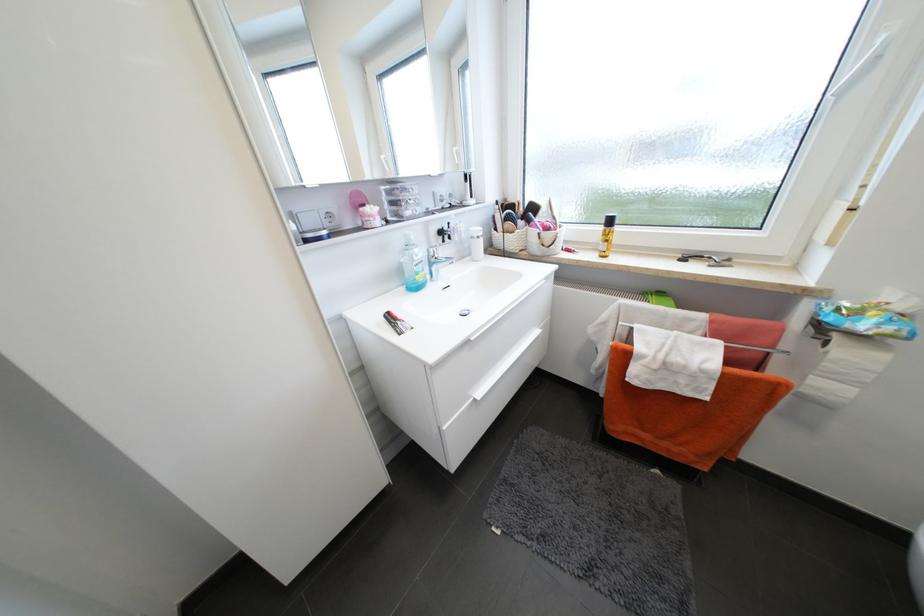
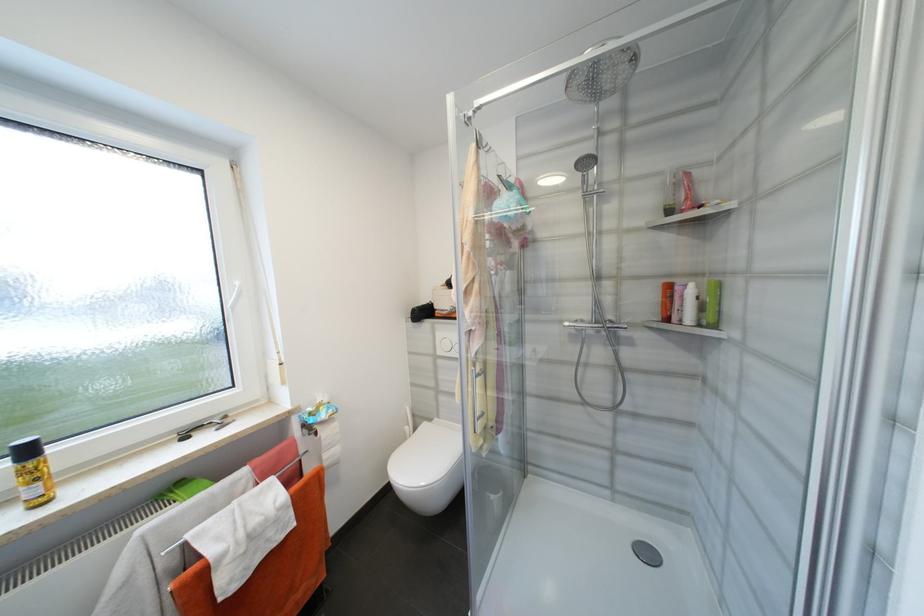
Locate, in the second image, the point that corresponds to (x=832, y=345) in the first image.

(322, 435)